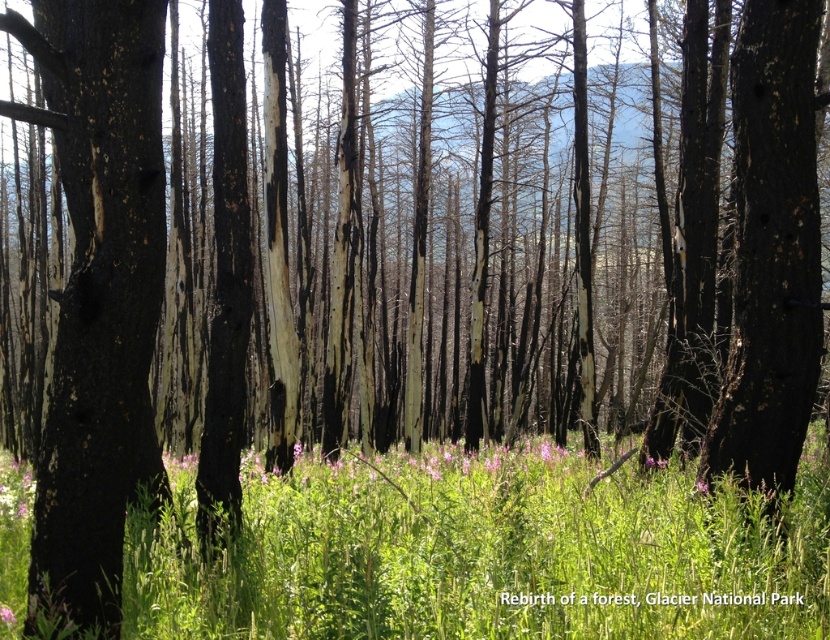
Question: Which of the following is the farthest from the observer?

Choices:
 (A) (819, 104)
 (B) (96, 456)

Answer: (A)

Question: Which of the following is the closest to the observer?

Choices:
 (A) green grassy at center
 (B) pink matte flower at center

Answer: (A)

Question: Is green grassy at center further to camera compared to pink matte flower at center?

Choices:
 (A) no
 (B) yes

Answer: (A)

Question: From the image, what is the correct spatial relationship of charred bark tree at left in relation to pink matte flower at center?

Choices:
 (A) above
 (B) below

Answer: (A)

Question: Can you confirm if charred bark tree at center is positioned to the left of pink matte flower at center?

Choices:
 (A) yes
 (B) no

Answer: (B)

Question: Which point appears farthest from the camera in this image?

Choices:
 (A) (11, 616)
 (B) (45, 467)

Answer: (A)